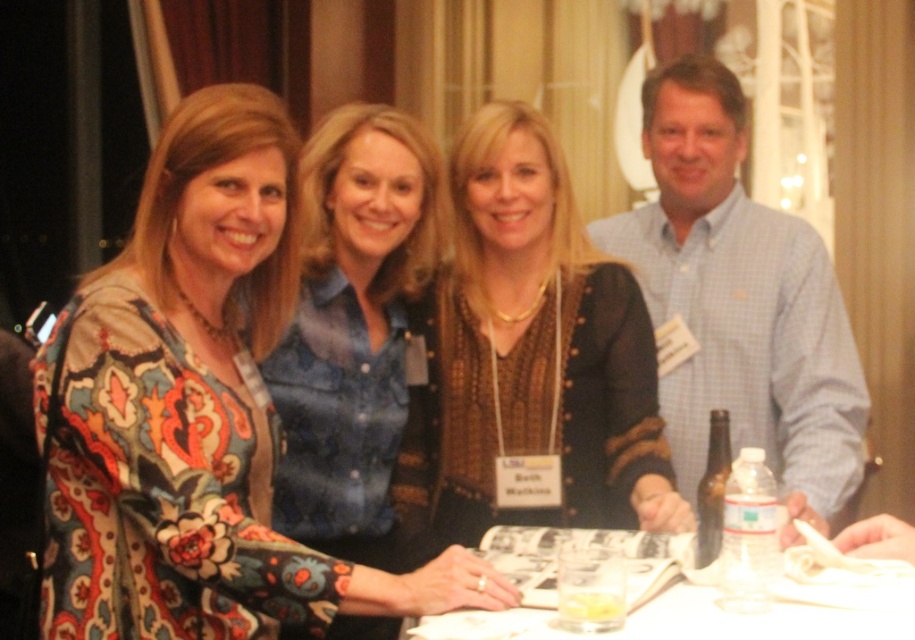
Question: Does floral-patterned dress at center appear over blue checkered shirt at center?

Choices:
 (A) no
 (B) yes

Answer: (A)

Question: Can you confirm if brown textured sweater at center is positioned above floral-patterned blouse at center?

Choices:
 (A) no
 (B) yes

Answer: (B)

Question: Does brown textured sweater at center come in front of floral-patterned blouse at center?

Choices:
 (A) yes
 (B) no

Answer: (B)

Question: Estimate the real-world distances between objects in this image. Which object is farther from the floral-patterned dress at center?

Choices:
 (A) blue checkered shirt at center
 (B) brown textured sweater at center
 (C) white paper at center

Answer: (A)

Question: Which point is closer to the camera?

Choices:
 (A) (374, 548)
 (B) (406, 481)
 (C) (660, 369)
 (D) (760, 621)

Answer: (D)

Question: Among these points, which one is nearest to the camera?

Choices:
 (A) (483, 355)
 (B) (341, 516)

Answer: (B)